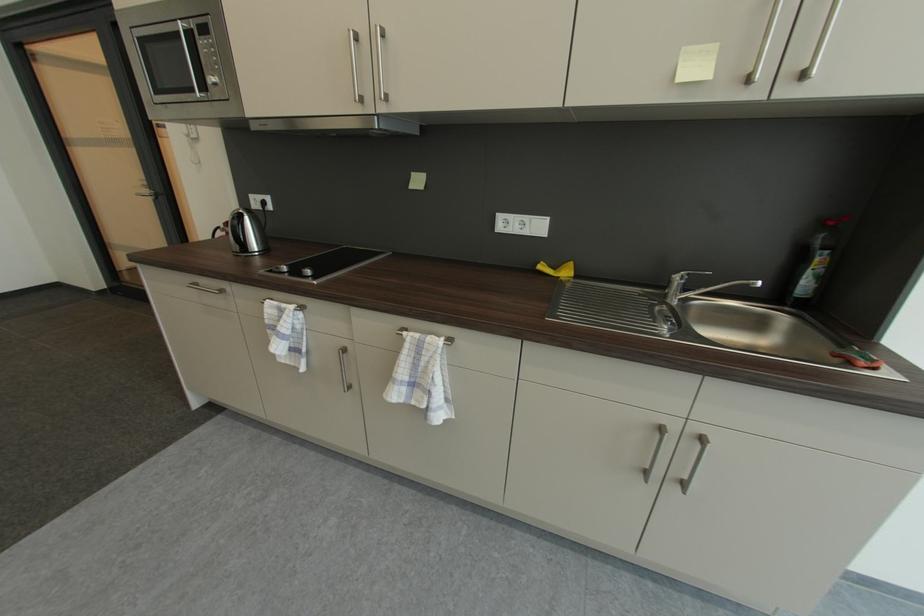
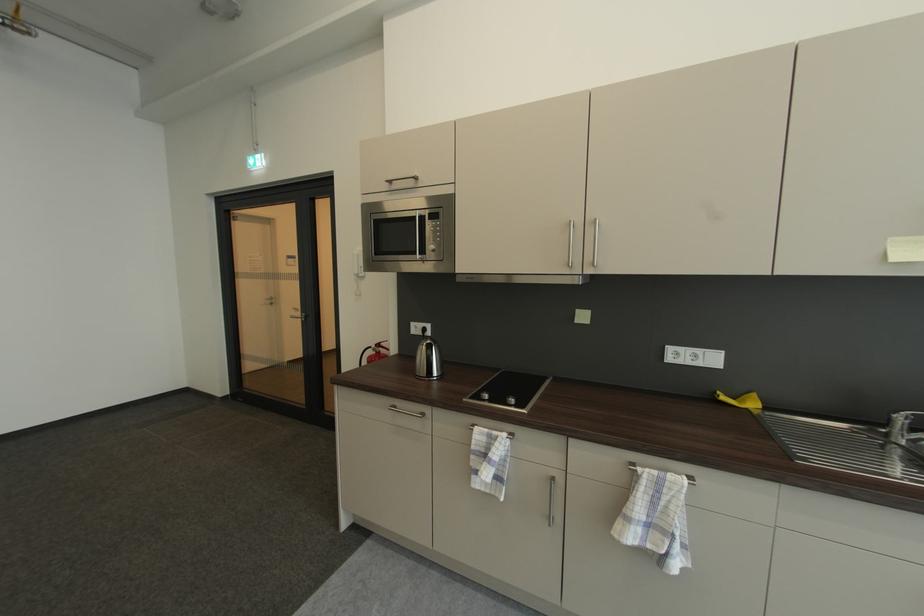
The point at (x=203, y=26) is marked in the first image. Where is the corresponding point in the second image?

(436, 215)